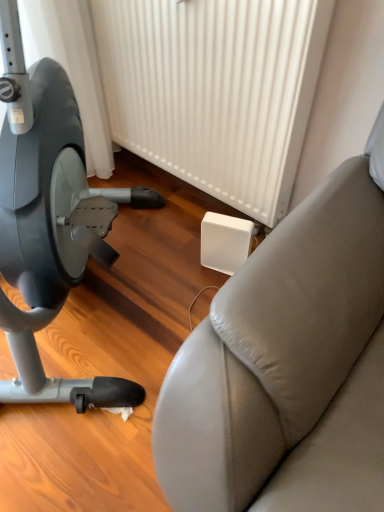
Question: Is matte gray stationary bicycle at left shorter than leather-like studio couch at right?

Choices:
 (A) no
 (B) yes

Answer: (A)

Question: Does matte gray stationary bicycle at left appear on the left side of leather-like studio couch at right?

Choices:
 (A) no
 (B) yes

Answer: (B)

Question: From a real-world perspective, is matte gray stationary bicycle at left physically above leather-like studio couch at right?

Choices:
 (A) yes
 (B) no

Answer: (A)

Question: Would you say leather-like studio couch at right is part of matte gray stationary bicycle at left's contents?

Choices:
 (A) no
 (B) yes

Answer: (A)

Question: Considering the relative sizes of matte gray stationary bicycle at left and leather-like studio couch at right in the image provided, is matte gray stationary bicycle at left bigger than leather-like studio couch at right?

Choices:
 (A) yes
 (B) no

Answer: (A)

Question: Are matte gray stationary bicycle at left and leather-like studio couch at right making contact?

Choices:
 (A) yes
 (B) no

Answer: (B)

Question: From a real-world perspective, does leather-like studio couch at right stand above white plastic radiator at center?

Choices:
 (A) yes
 (B) no

Answer: (B)

Question: Considering the relative positions of leather-like studio couch at right and white plastic radiator at center in the image provided, is leather-like studio couch at right in front of white plastic radiator at center?

Choices:
 (A) yes
 (B) no

Answer: (A)

Question: Is leather-like studio couch at right shorter than white plastic radiator at center?

Choices:
 (A) no
 (B) yes

Answer: (B)

Question: Considering the relative sizes of leather-like studio couch at right and white plastic radiator at center in the image provided, is leather-like studio couch at right wider than white plastic radiator at center?

Choices:
 (A) yes
 (B) no

Answer: (A)

Question: Is leather-like studio couch at right aimed at white plastic radiator at center?

Choices:
 (A) no
 (B) yes

Answer: (A)

Question: Is leather-like studio couch at right oriented away from white plastic radiator at center?

Choices:
 (A) no
 (B) yes

Answer: (A)

Question: Considering the relative sizes of white plastic radiator at center and leather-like studio couch at right in the image provided, is white plastic radiator at center taller than leather-like studio couch at right?

Choices:
 (A) no
 (B) yes

Answer: (B)